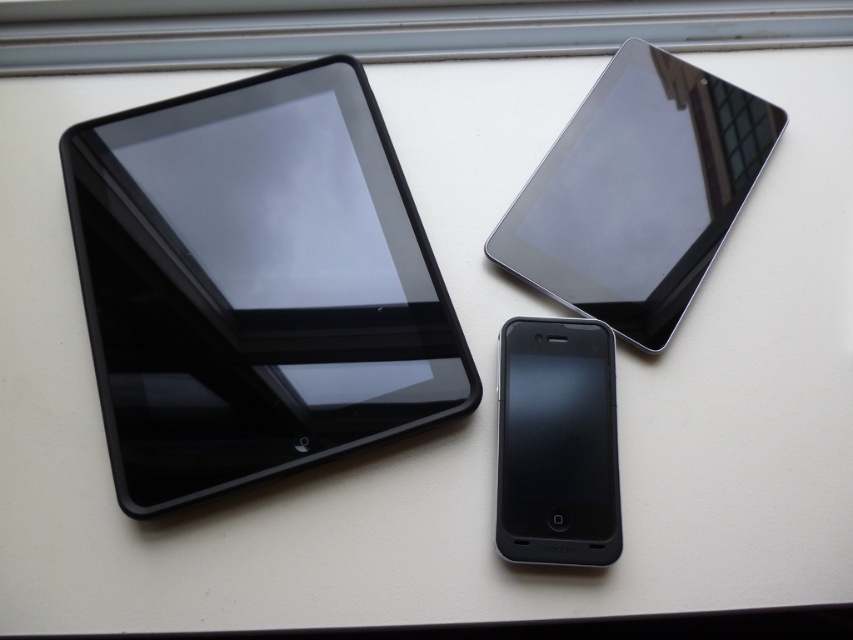
What are the coordinates of the black glossy tablet at left?

The coordinates of the black glossy tablet at left are at point [254,284].

You are organizing these devices on the windowsill. If you want to place the glossy black tablet at upper right to the left of the matte black tablet at center, which device should you move and in what direction?

You should move the glossy black tablet at upper right to the left so it is positioned to the left of the matte black tablet at center.

You are trying to place a new phone case that is 12 cm wide between the black glossy tablet at left and the matte black tablet at center. Can the case fit in the space between them?

The black glossy tablet at left is wider than the matte black tablet at center. However, the exact width difference isn not specified, so it is uncertain if the 12 cm wide case can fit between them.